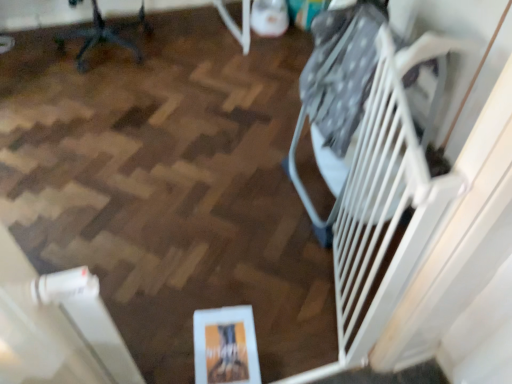
Measure the distance between point (389,281) and camera.

They are 3.47 feet apart.

The height and width of the screenshot is (384, 512). I want to click on white plastic gate at right, so click(381, 210).

What is the approximate height of white plastic gate at right?

It is 36.21 inches.

Looking at this image, in order to face white plastic gate at right, should I rotate leftwards or rightwards?

Turn right approximately 14.820 degrees to face it.

What do you see at coordinates (381, 210) in the screenshot? The height and width of the screenshot is (384, 512). I see `white plastic gate at right` at bounding box center [381, 210].

This screenshot has width=512, height=384. What do you see at coordinates (104, 35) in the screenshot?
I see `metallic office chair at upper left` at bounding box center [104, 35].

At what (x,y) coordinates should I click in order to perform the action: click on metallic office chair at upper left. Please return your answer as a coordinate pair (x, y). This screenshot has height=384, width=512. Looking at the image, I should click on (104, 35).

In order to click on white plastic gate at right in this screenshot , I will do `click(381, 210)`.

Which object is positioned more to the right, white plastic gate at right or metallic office chair at upper left?

white plastic gate at right is more to the right.

Looking at this image, relative to metallic office chair at upper left, is white plastic gate at right in front or behind?

white plastic gate at right is in front of metallic office chair at upper left.

Considering the positions of points (389, 196) and (62, 40), is point (389, 196) farther from camera compared to point (62, 40)?

No, it is in front of (62, 40).

From the image's perspective, is white plastic gate at right positioned above or below metallic office chair at upper left?

Clearly, from the image's perspective, white plastic gate at right is below metallic office chair at upper left.

From a real-world perspective, which is physically below, white plastic gate at right or metallic office chair at upper left?

In real-world perspective, metallic office chair at upper left is lower.

Can you confirm if white plastic gate at right is wider than metallic office chair at upper left?

Yes.

Who is shorter, white plastic gate at right or metallic office chair at upper left?

metallic office chair at upper left.

Can you confirm if white plastic gate at right is bigger than metallic office chair at upper left?

Actually, white plastic gate at right might be smaller than metallic office chair at upper left.

Is white plastic gate at right located outside metallic office chair at upper left?

Indeed, white plastic gate at right is completely outside metallic office chair at upper left.

Is white plastic gate at right not close to metallic office chair at upper left?

That's right, there is a large distance between white plastic gate at right and metallic office chair at upper left.

Is white plastic gate at right facing away from metallic office chair at upper left?

No.

How many degrees apart are the facing directions of white plastic gate at right and metallic office chair at upper left?

The facing directions of white plastic gate at right and metallic office chair at upper left are 61.4 degrees apart.

Identify the location of furniture that is under the white plastic gate at right (from a real-world perspective). (104, 35).

Can you confirm if metallic office chair at upper left is positioned to the right of white plastic gate at right?

In fact, metallic office chair at upper left is to the left of white plastic gate at right.

Consider the image. Which object is closer to the camera taking this photo, metallic office chair at upper left or white plastic gate at right?

white plastic gate at right.

Is point (66, 36) closer to viewer compared to point (365, 211)?

No.

From the image's perspective, is metallic office chair at upper left above or below white plastic gate at right?

metallic office chair at upper left is above white plastic gate at right.

From a real-world perspective, is metallic office chair at upper left positioned above or below white plastic gate at right?

In terms of real-world spatial position, metallic office chair at upper left is below white plastic gate at right.

Considering the relative sizes of metallic office chair at upper left and white plastic gate at right in the image provided, is metallic office chair at upper left thinner than white plastic gate at right?

Correct, the width of metallic office chair at upper left is less than that of white plastic gate at right.

Considering the relative sizes of metallic office chair at upper left and white plastic gate at right in the image provided, is metallic office chair at upper left taller than white plastic gate at right?

Incorrect, the height of metallic office chair at upper left is not larger of that of white plastic gate at right.

In terms of size, does metallic office chair at upper left appear bigger or smaller than white plastic gate at right?

In the image, metallic office chair at upper left appears to be larger than white plastic gate at right.

Is metallic office chair at upper left outside of white plastic gate at right?

That's correct, metallic office chair at upper left is outside of white plastic gate at right.

Are metallic office chair at upper left and white plastic gate at right making contact?

No, metallic office chair at upper left is not in contact with white plastic gate at right.

Is metallic office chair at upper left aimed at white plastic gate at right?

No, metallic office chair at upper left is not turned towards white plastic gate at right.

In the image, there is a metallic office chair at upper left. At what (x,y) coordinates should I click in order to perform the action: click on stairs below it (from the image's perspective). Please return your answer as a coordinate pair (x, y). This screenshot has height=384, width=512. Looking at the image, I should click on (381, 210).

What are the coordinates of `furniture above the white plastic gate at right (from the image's perspective)` in the screenshot? It's located at (104, 35).

Locate an element on the screen. The image size is (512, 384). furniture on the left of white plastic gate at right is located at coordinates (104, 35).